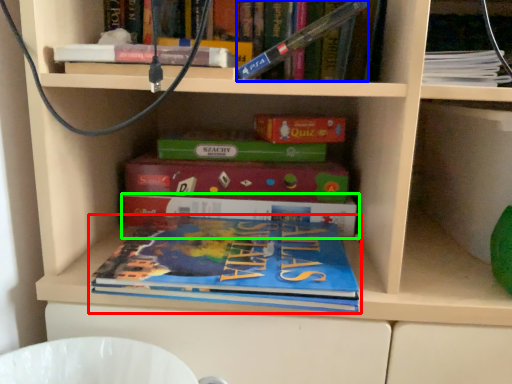
Question: Estimate the real-world distances between objects in this image. Which object is closer to book (highlighted by a red box), book (highlighted by a blue box) or book (highlighted by a green box)?

Choices:
 (A) book
 (B) book

Answer: (B)